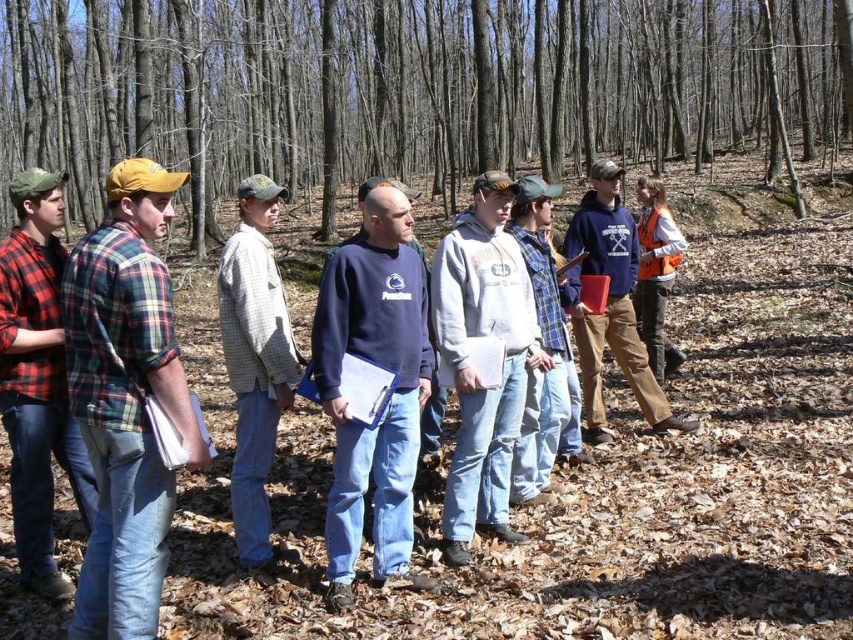
You are a photographer positioned in front of the group. You want to take a photo that includes both the brown bark tree at center and the matte blue sweatshirt at center. Which object should you focus on first to ensure both are in clear view?

You should focus on the brown bark tree at center first because it is closer to you than the matte blue sweatshirt at center. By focusing on the closer object, both will be in clear view due to the depth of field.

You are a photographer standing at the back of the group. You want to take a photo that includes both the dark blue fleece sweatshirt at center and the red plaid shirt at left. Given that your camera has a maximum focus range of 1.5 meters, will both subjects be in focus?

The dark blue fleece sweatshirt at center and the red plaid shirt at left are 1.58 meters apart. Since the distance between them exceeds the camera s 1.5 meter focus range, both subjects may not be in focus simultaneously.